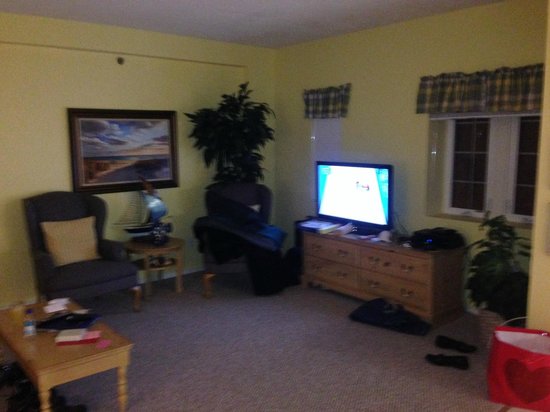
The image size is (550, 412). Identify the location of blinds. (330, 147).